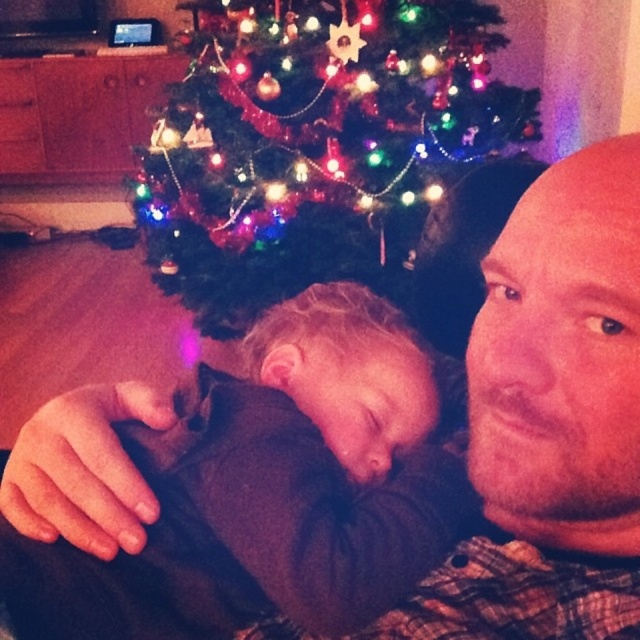
Question: Which of the following is the closest to the observer?

Choices:
 (A) green matte christmas tree at upper center
 (B) soft brown sweater at center

Answer: (B)

Question: Is soft brown sweater at center wider than green matte christmas tree at upper center?

Choices:
 (A) yes
 (B) no

Answer: (B)

Question: Does soft brown sweater at center have a lesser width compared to green matte christmas tree at upper center?

Choices:
 (A) yes
 (B) no

Answer: (A)

Question: Is soft brown sweater at center smaller than green matte christmas tree at upper center?

Choices:
 (A) yes
 (B) no

Answer: (A)